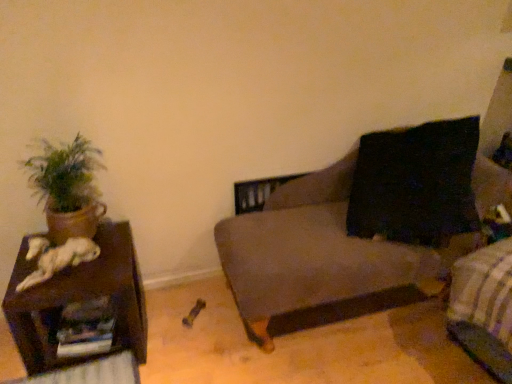
Image resolution: width=512 pixels, height=384 pixels. What do you see at coordinates (80, 299) in the screenshot?
I see `brown wooden side table at left` at bounding box center [80, 299].

Locate an element on the screen. green matte plant at left is located at coordinates (68, 188).

This screenshot has height=384, width=512. What do you see at coordinates (484, 307) in the screenshot? I see `dark brown fabric bed frame at lower right` at bounding box center [484, 307].

Describe the element at coordinates (315, 252) in the screenshot. I see `dark gray fabric couch at center` at that location.

Identify the location of brown wooden side table at left. The height and width of the screenshot is (384, 512). (80, 299).

Which is closer, (126, 309) or (497, 251)?

Point (126, 309).

Which object is further away from the camera taking this photo, brown wooden side table at left or dark brown fabric bed frame at lower right?

Positioned behind is brown wooden side table at left.

Find the location of `furniture below the dark brown fabric bed frame at lower right (from the image's perspective)`. furniture below the dark brown fabric bed frame at lower right (from the image's perspective) is located at coordinates click(x=80, y=299).

Is brown wooden side table at left oriented towards dark brown fabric bed frame at lower right?

No, brown wooden side table at left is not aimed at dark brown fabric bed frame at lower right.

Locate an element on the screen. The width and height of the screenshot is (512, 384). studio couch on the right of green matte plant at left is located at coordinates (315, 252).

From the image's perspective, between green matte plant at left and dark gray fabric couch at center, which one is located above?

green matte plant at left appears higher in the image.

Which is correct: green matte plant at left is inside dark gray fabric couch at center, or outside of it?

green matte plant at left is not inside dark gray fabric couch at center, it's outside.

From a real-world perspective, who is located higher, green matte plant at left or dark gray fabric couch at center?

From a 3D spatial view, green matte plant at left is above.

Considering the sizes of objects green matte plant at left and brown wooden side table at left in the image provided, who is shorter, green matte plant at left or brown wooden side table at left?

brown wooden side table at left is shorter.

What's the angular difference between green matte plant at left and brown wooden side table at left's facing directions?

The facing directions of green matte plant at left and brown wooden side table at left are 0.0126 degrees apart.

The height and width of the screenshot is (384, 512). Find the location of `houseplant above the brown wooden side table at left (from the image's perspective)`. houseplant above the brown wooden side table at left (from the image's perspective) is located at coordinates (68, 188).

Looking at this image, would you say green matte plant at left is inside or outside brown wooden side table at left?

green matte plant at left is outside brown wooden side table at left.

Considering the positions of objects dark brown fabric bed frame at lower right and brown wooden side table at left in the image provided, who is more to the right, dark brown fabric bed frame at lower right or brown wooden side table at left?

Positioned to the right is dark brown fabric bed frame at lower right.

Does dark brown fabric bed frame at lower right have a lesser height compared to brown wooden side table at left?

No, dark brown fabric bed frame at lower right is not shorter than brown wooden side table at left.

How different are the orientations of dark brown fabric bed frame at lower right and brown wooden side table at left in degrees?

The angle between the facing direction of dark brown fabric bed frame at lower right and the facing direction of brown wooden side table at left is 84.6 degrees.

Is point (499, 353) farther from camera compared to point (132, 281)?

No, (499, 353) is in front of (132, 281).

Which is closer to the camera, (x=337, y=209) or (x=481, y=270)?

The point (x=481, y=270) is closer.

From the image's perspective, is dark gray fabric couch at center located beneath dark brown fabric bed frame at lower right?

No.

Does dark gray fabric couch at center appear on the left side of dark brown fabric bed frame at lower right?

Yes, dark gray fabric couch at center is to the left of dark brown fabric bed frame at lower right.

Which point is more forward, (x=395, y=252) or (x=66, y=234)?

Positioned in front is point (x=66, y=234).

From a real-world perspective, which is physically below, dark gray fabric couch at center or green matte plant at left?

dark gray fabric couch at center is physically lower.

In the scene shown: Are dark gray fabric couch at center and green matte plant at left beside each other?

No, dark gray fabric couch at center is not next to green matte plant at left.

Which of these two, dark gray fabric couch at center or green matte plant at left, stands taller?

dark gray fabric couch at center is taller.

Does brown wooden side table at left have a larger size compared to green matte plant at left?

Yes, brown wooden side table at left is bigger than green matte plant at left.

Does brown wooden side table at left lie behind green matte plant at left?

No, the depth of brown wooden side table at left is less than that of green matte plant at left.

Which is in front, point (57, 317) or point (94, 162)?

The point (94, 162) is closer to the camera.

Find the location of `furniture behind the dark brown fabric bed frame at lower right`. furniture behind the dark brown fabric bed frame at lower right is located at coordinates (80, 299).

Where is `studio couch in front of the green matte plant at left`? This screenshot has width=512, height=384. studio couch in front of the green matte plant at left is located at coordinates pos(315,252).

Based on their spatial positions, is brown wooden side table at left or green matte plant at left further from dark brown fabric bed frame at lower right?

green matte plant at left is further to dark brown fabric bed frame at lower right.

Looking at the image, which one is located closer to dark gray fabric couch at center, brown wooden side table at left or green matte plant at left?

brown wooden side table at left is positioned closer to the anchor dark gray fabric couch at center.

Considering their positions, is dark brown fabric bed frame at lower right positioned further to dark gray fabric couch at center than brown wooden side table at left?

brown wooden side table at left is further to dark gray fabric couch at center.

Looking at the image, which one is located further to dark brown fabric bed frame at lower right, dark gray fabric couch at center or brown wooden side table at left?

brown wooden side table at left lies further to dark brown fabric bed frame at lower right than the other object.

Looking at the image, which one is located further to brown wooden side table at left, green matte plant at left or dark brown fabric bed frame at lower right?

Among the two, dark brown fabric bed frame at lower right is located further to brown wooden side table at left.

When comparing their distances from brown wooden side table at left, does dark gray fabric couch at center or green matte plant at left seem further?

dark gray fabric couch at center lies further to brown wooden side table at left than the other object.

Considering their positions, is brown wooden side table at left positioned further to dark brown fabric bed frame at lower right than dark gray fabric couch at center?

Based on the image, brown wooden side table at left appears to be further to dark brown fabric bed frame at lower right.

Looking at the image, which one is located closer to brown wooden side table at left, dark brown fabric bed frame at lower right or dark gray fabric couch at center?

dark gray fabric couch at center is closer to brown wooden side table at left.

This screenshot has height=384, width=512. I want to click on furniture between green matte plant at left and dark brown fabric bed frame at lower right from left to right, so click(80, 299).

At what (x,y) coordinates should I click in order to perform the action: click on studio couch between brown wooden side table at left and dark brown fabric bed frame at lower right. Please return your answer as a coordinate pair (x, y). The height and width of the screenshot is (384, 512). Looking at the image, I should click on (315, 252).

Locate an element on the screen. The height and width of the screenshot is (384, 512). furniture between green matte plant at left and dark gray fabric couch at center from left to right is located at coordinates (80, 299).

You are a GUI agent. You are given a task and a screenshot of the screen. Output one action in this format:
    pyautogui.click(x=<x>, y=<y>)
    Task: Click on the studio couch between green matte plant at left and dark brown fabric bed frame at lower right
    The width and height of the screenshot is (512, 384).
    Given the screenshot: What is the action you would take?
    pyautogui.click(x=315, y=252)